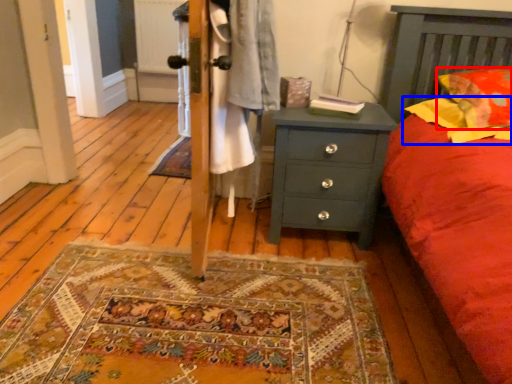
Question: Among these objects, which one is nearest to the camera, pillow (highlighted by a red box) or pillow (highlighted by a blue box)?

Choices:
 (A) pillow
 (B) pillow

Answer: (B)